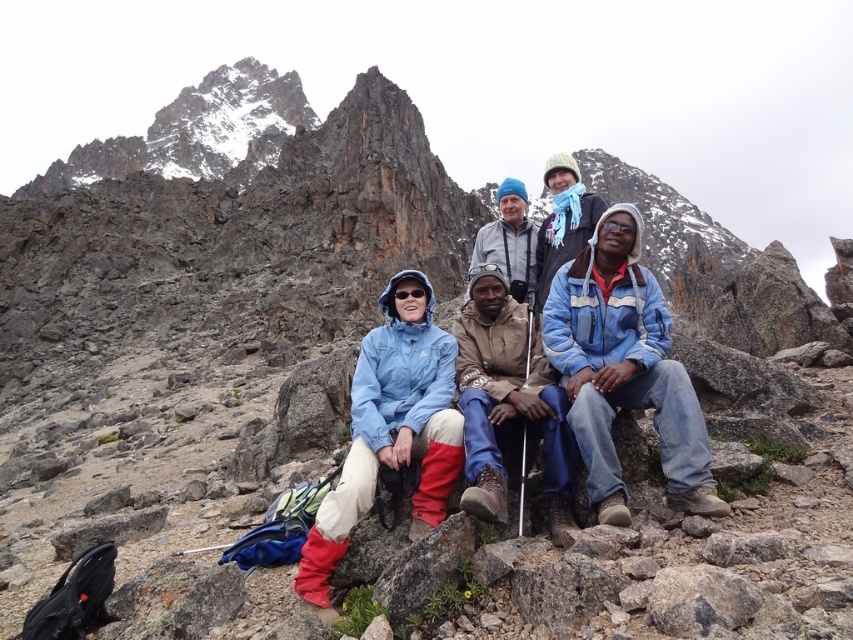
Can you confirm if blue denim jacket at lower right is positioned above matte blue jacket at center?

Yes.

Is point (619, 294) closer to viewer compared to point (392, 301)?

Yes, point (619, 294) is in front of point (392, 301).

Does point (589, 461) come in front of point (383, 336)?

Yes, point (589, 461) is closer to viewer.

This screenshot has height=640, width=853. I want to click on blue denim jacket at lower right, so click(624, 369).

Is blue denim jacket at lower right below brown suede jacket at center?

Actually, blue denim jacket at lower right is above brown suede jacket at center.

Between blue denim jacket at lower right and brown suede jacket at center, which one is positioned higher?

Positioned higher is blue denim jacket at lower right.

Where is `blue denim jacket at lower right`? This screenshot has width=853, height=640. blue denim jacket at lower right is located at coordinates (624, 369).

Who is higher up, matte blue jacket at center or brown suede jacket at center?

Positioned higher is brown suede jacket at center.

Is matte blue jacket at center bigger than brown suede jacket at center?

Yes.

Find the location of a particular element. This screenshot has width=853, height=640. matte blue jacket at center is located at coordinates (390, 429).